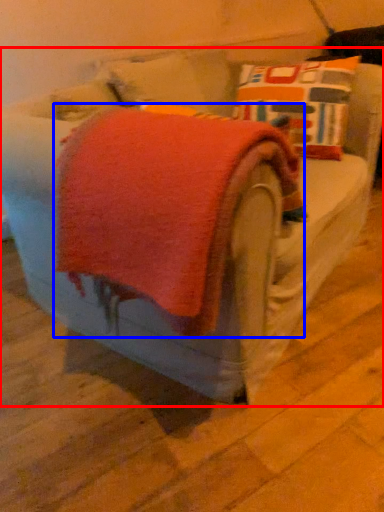
Question: Which of the following is the farthest to the observer, furniture (highlighted by a red box) or bath towel (highlighted by a blue box)?

Choices:
 (A) furniture
 (B) bath towel

Answer: (B)